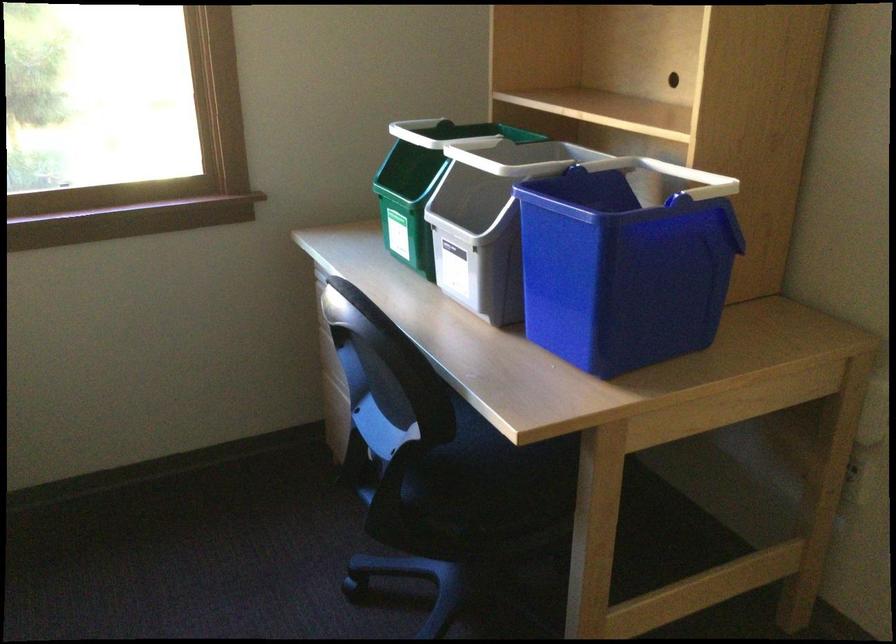
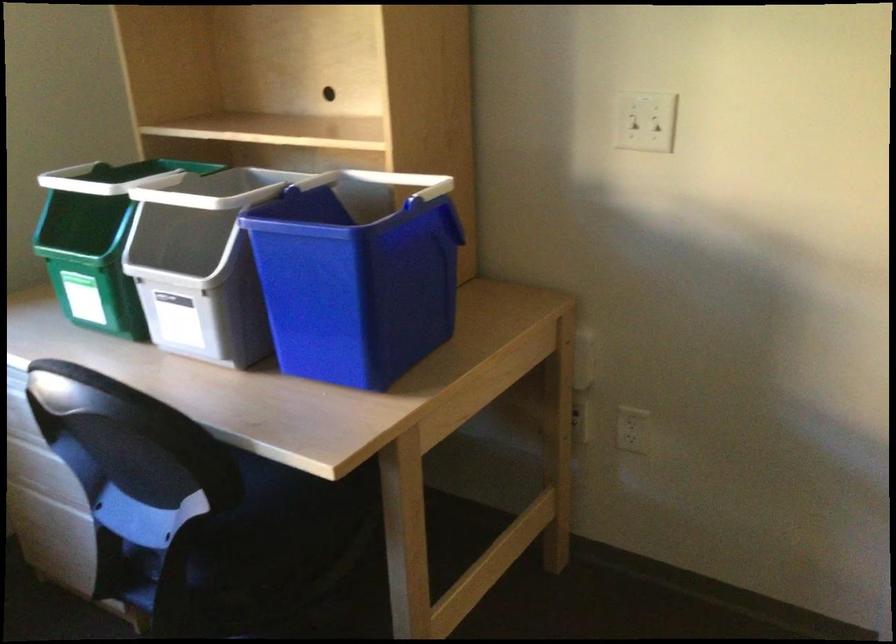
Locate, in the second image, the point that corresponds to pixel 389 431 in the first image.

(151, 518)